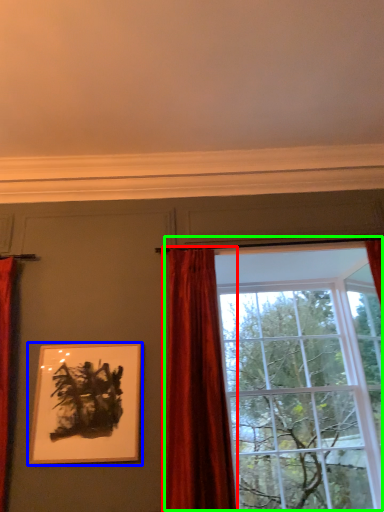
Question: Considering the real-world distances, which object is farthest from curtain (highlighted by a red box)? picture frame (highlighted by a blue box) or window (highlighted by a green box)?

Choices:
 (A) picture frame
 (B) window

Answer: (A)